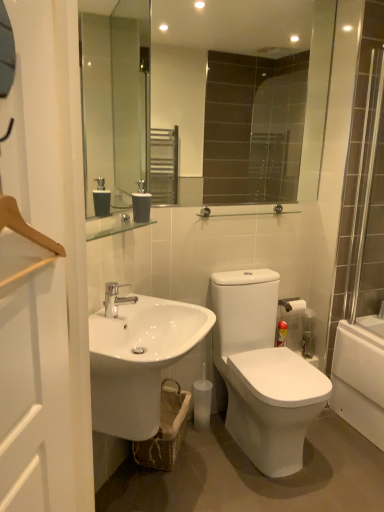
Question: Considering the positions of silver metallic faucet at center and matte gray soap dispenser at center in the image, is silver metallic faucet at center taller or shorter than matte gray soap dispenser at center?

Choices:
 (A) tall
 (B) short

Answer: (B)

Question: From the image's perspective, is silver metallic faucet at center positioned above or below matte gray soap dispenser at center?

Choices:
 (A) below
 (B) above

Answer: (A)

Question: Which object is the farthest from the white wooden screen door at left?

Choices:
 (A) white glossy sink at lower left
 (B) glossy glass mirror at upper center
 (C) matte gray soap dispenser at center
 (D) silver metallic shower door at right
 (E) white matte toilet paper at right

Answer: (B)

Question: Which object is positioned closest to the silver metallic faucet at center?

Choices:
 (A) matte gray soap dispenser at center
 (B) white matte toilet paper at right
 (C) white wooden screen door at left
 (D) metallic silver can at right
 (E) glossy glass mirror at upper center

Answer: (A)